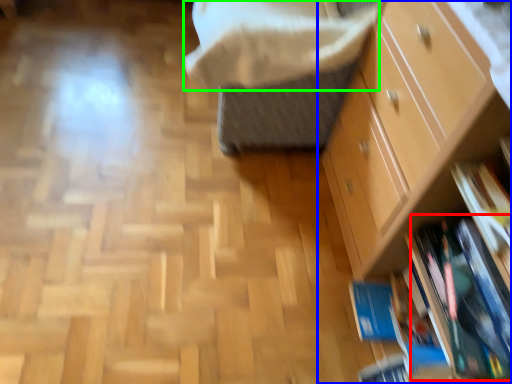
Question: Estimate the real-world distances between objects in this image. Which object is farther from book (highlighted by a red box), chest of drawers (highlighted by a blue box) or blanket (highlighted by a green box)?

Choices:
 (A) chest of drawers
 (B) blanket

Answer: (B)